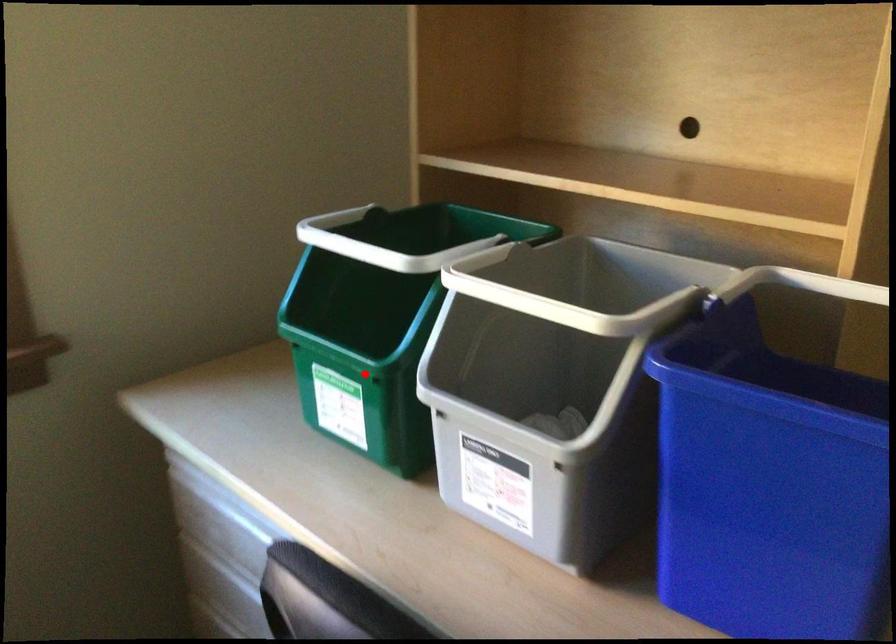
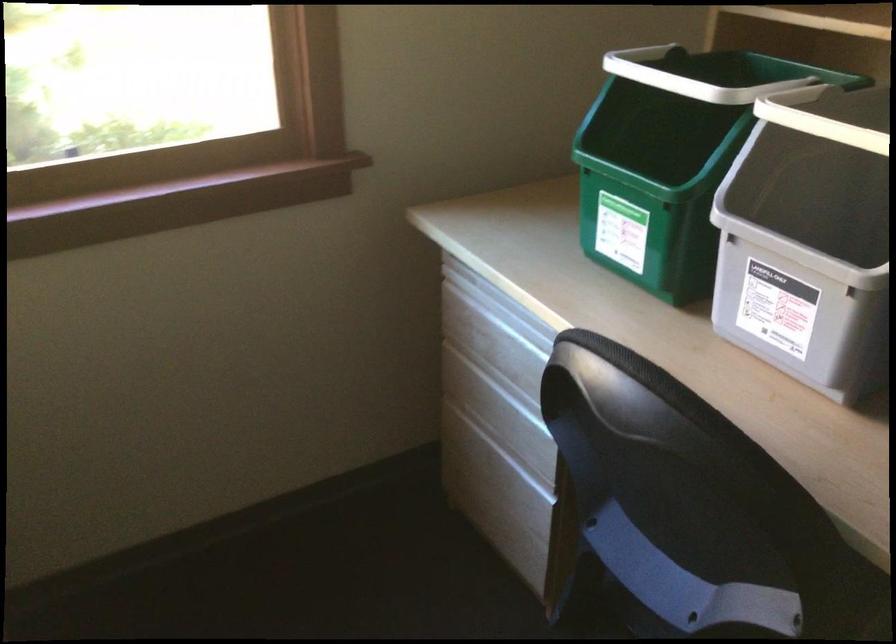
Find the pixel in the second image that matches the highlighted location in the first image.

(652, 194)